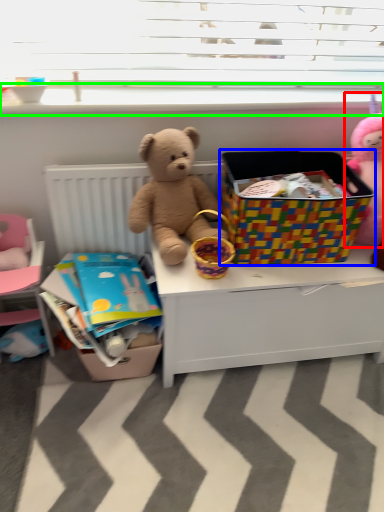
Question: Considering the real-world distances, which object is farthest from toy (highlighted by a red box)? box (highlighted by a blue box) or window sill (highlighted by a green box)?

Choices:
 (A) box
 (B) window sill

Answer: (B)